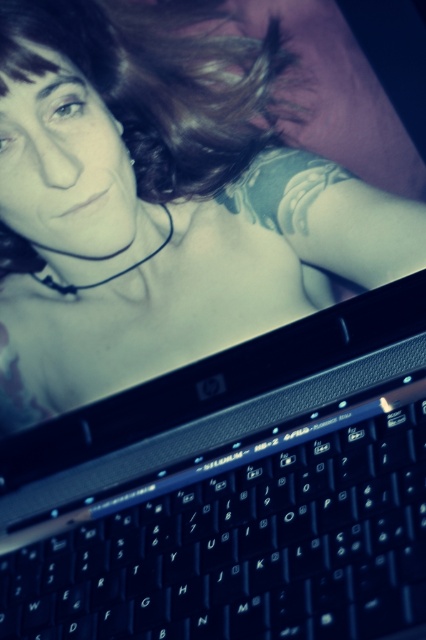
Which is below, matte black laptop at lower center or black plastic keyboard at bottom?

black plastic keyboard at bottom is lower down.

Does matte black laptop at lower center have a greater width compared to black plastic keyboard at bottom?

Yes, matte black laptop at lower center is wider than black plastic keyboard at bottom.

Is point (63, 388) positioned after point (238, 528)?

Yes, point (63, 388) is farther from viewer.

Find the location of `matte black laptop at lower center`. matte black laptop at lower center is located at coordinates (158, 204).

Consider the image. Between black plastic keyboard at bottom and dark brown curly hair at upper center, which one has less height?

Standing shorter between the two is black plastic keyboard at bottom.

Is black plastic keyboard at bottom taller than dark brown curly hair at upper center?

No, black plastic keyboard at bottom is not taller than dark brown curly hair at upper center.

Is point (108, 541) closer to camera compared to point (9, 262)?

Yes, it is in front of point (9, 262).

Identify the location of black plastic keyboard at bottom. (241, 541).

Between matte black laptop at lower center and dark brown curly hair at upper center, which one appears on the right side from the viewer's perspective?

From the viewer's perspective, matte black laptop at lower center appears more on the right side.

At what (x,y) coordinates should I click in order to perform the action: click on matte black laptop at lower center. Please return your answer as a coordinate pair (x, y). Image resolution: width=426 pixels, height=640 pixels. Looking at the image, I should click on (158, 204).

Is point (2, 310) closer to camera compared to point (31, 52)?

No, it is behind (31, 52).

The image size is (426, 640). Identify the location of matte black laptop at lower center. (158, 204).